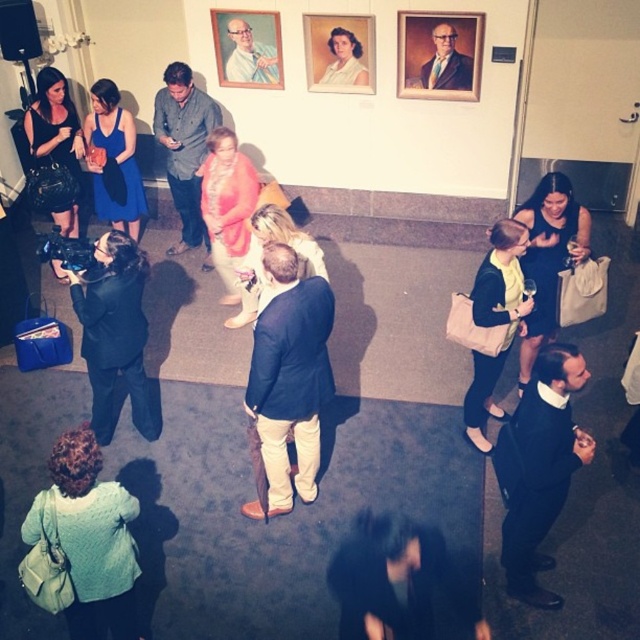
Is black satin suit at lower right smaller than matte gray shirt at center?

Indeed, black satin suit at lower right has a smaller size compared to matte gray shirt at center.

Where is `black satin suit at lower right`? This screenshot has height=640, width=640. black satin suit at lower right is located at coordinates (538, 467).

Which is behind, point (424, 38) or point (301, 273)?

The point (424, 38) is more distant.

Who is positioned more to the left, wooden portrait frame at upper center or matte pink scarf at center?

Positioned to the left is matte pink scarf at center.

Locate an element on the screen. This screenshot has width=640, height=640. wooden portrait frame at upper center is located at coordinates (440, 54).

Who is shorter, blue satin dress at center or formal portrait at center?

formal portrait at center

Does blue satin dress at center appear on the right side of formal portrait at center?

Incorrect, blue satin dress at center is not on the right side of formal portrait at center.

This screenshot has height=640, width=640. Find the location of `blue satin dress at center`. blue satin dress at center is located at coordinates (113, 161).

Locate an element on the screen. The height and width of the screenshot is (640, 640). blue satin dress at center is located at coordinates [113, 161].